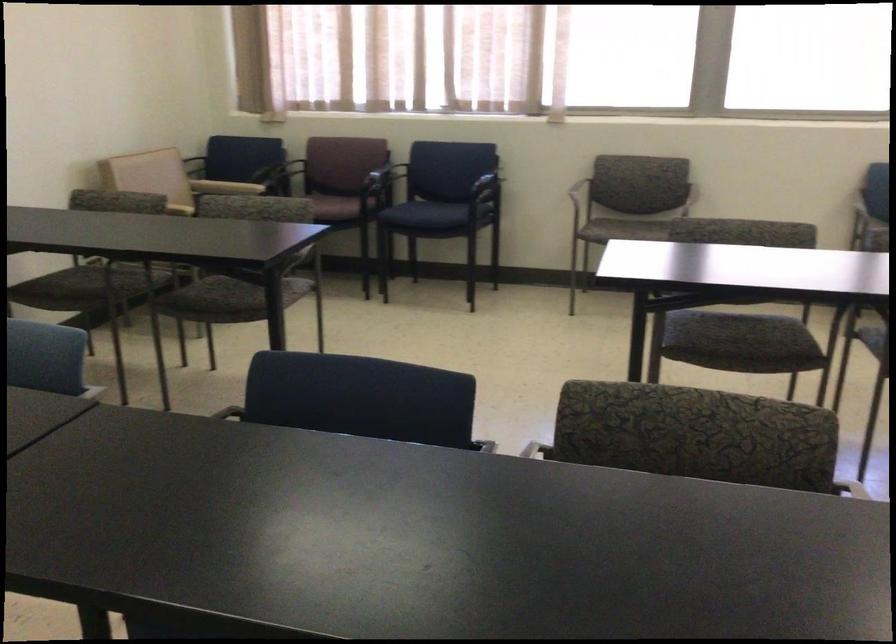
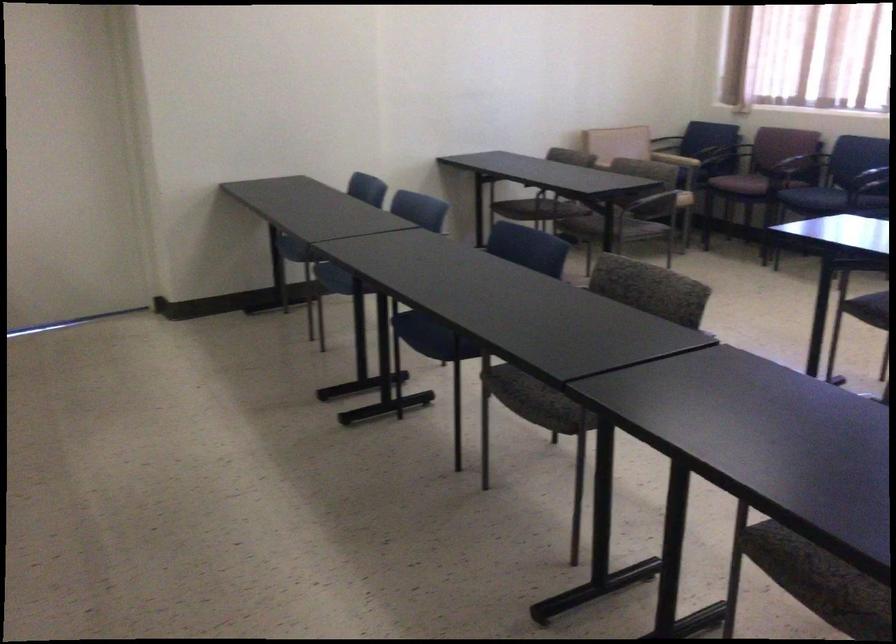
The point at (678, 345) is marked in the first image. Where is the corresponding point in the second image?

(868, 308)